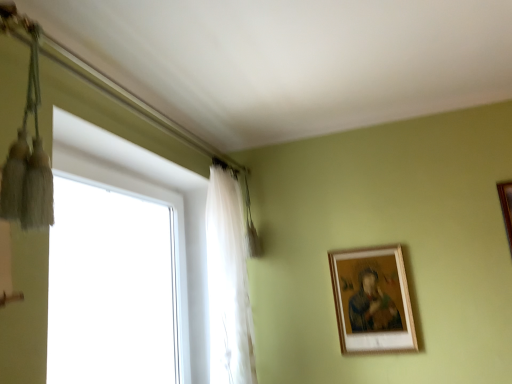
Question: Are translucent white curtain at upper left and white glass window at left far apart?

Choices:
 (A) yes
 (B) no

Answer: (B)

Question: From a real-world perspective, is translucent white curtain at upper left positioned over white glass window at left based on gravity?

Choices:
 (A) no
 (B) yes

Answer: (B)

Question: Considering the relative sizes of translucent white curtain at upper left and white glass window at left in the image provided, is translucent white curtain at upper left thinner than white glass window at left?

Choices:
 (A) yes
 (B) no

Answer: (B)

Question: Is translucent white curtain at upper left at the right side of white glass window at left?

Choices:
 (A) yes
 (B) no

Answer: (A)

Question: From the image's perspective, does translucent white curtain at upper left appear higher than white glass window at left?

Choices:
 (A) yes
 (B) no

Answer: (A)

Question: From a real-world perspective, is brown wooden picture frame at upper right, the second picture frame when ordered from bottom to top, positioned above or below white glass window at left?

Choices:
 (A) below
 (B) above

Answer: (B)

Question: Is brown wooden picture frame at upper right, which is the 1th picture frame from top to bottom, spatially inside white glass window at left, or outside of it?

Choices:
 (A) outside
 (B) inside

Answer: (A)

Question: Looking at their shapes, would you say brown wooden picture frame at upper right, which is the 1th picture frame from top to bottom, is wider or thinner than white glass window at left?

Choices:
 (A) thin
 (B) wide

Answer: (A)

Question: Considering the positions of brown wooden picture frame at upper right, the second picture frame positioned from the left, and white glass window at left in the image, is brown wooden picture frame at upper right, the second picture frame positioned from the left, taller or shorter than white glass window at left?

Choices:
 (A) short
 (B) tall

Answer: (A)

Question: Is white glass window at left inside or outside of brown wooden picture frame at upper right, the second picture frame positioned from the left?

Choices:
 (A) outside
 (B) inside

Answer: (A)

Question: In the image, is white glass window at left positioned in front of or behind brown wooden picture frame at upper right, the second picture frame when ordered from bottom to top?

Choices:
 (A) front
 (B) behind

Answer: (A)

Question: From the image's perspective, is white glass window at left positioned above or below brown wooden picture frame at upper right, the second picture frame positioned from the left?

Choices:
 (A) above
 (B) below

Answer: (B)

Question: Does point (186, 218) appear closer or farther from the camera than point (505, 192)?

Choices:
 (A) farther
 (B) closer

Answer: (A)

Question: From a real-world perspective, is translucent white curtain at upper left above or below white glass window at left?

Choices:
 (A) above
 (B) below

Answer: (A)

Question: From the image's perspective, is translucent white curtain at upper left above or below white glass window at left?

Choices:
 (A) below
 (B) above

Answer: (B)